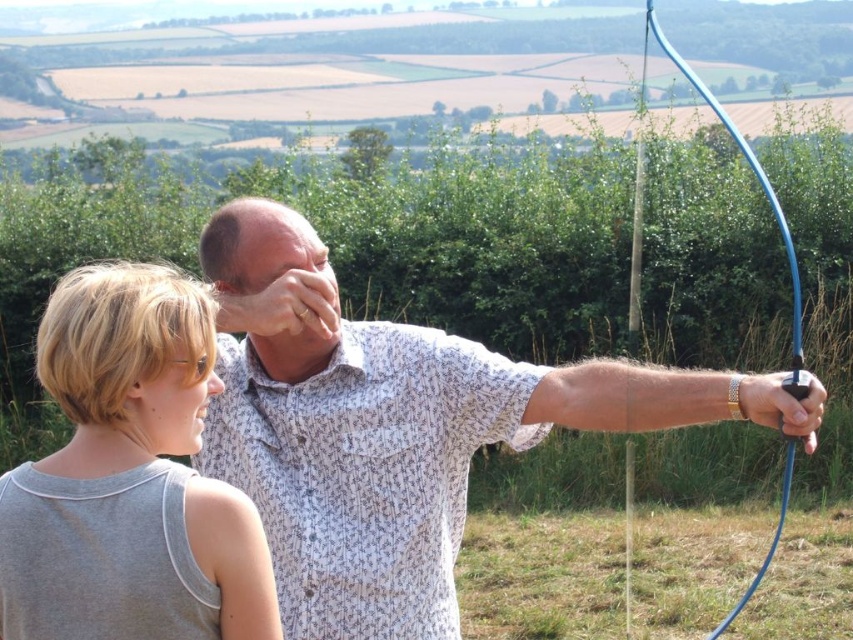
Question: In this image, where is white printed shirt at center located relative to gray fabric shirt at upper left?

Choices:
 (A) below
 (B) above

Answer: (A)

Question: Considering the real-world distances, which object is farthest from the blue rubber bow at right?

Choices:
 (A) gray fabric shirt at upper left
 (B) white printed shirt at center

Answer: (A)

Question: Where is white printed shirt at center located in relation to blue rubber bow at right in the image?

Choices:
 (A) above
 (B) below

Answer: (B)

Question: Which point appears closest to the camera in this image?

Choices:
 (A) (659, 35)
 (B) (135, 577)

Answer: (B)

Question: Is gray fabric shirt at upper left wider than blue rubber bow at right?

Choices:
 (A) no
 (B) yes

Answer: (A)

Question: Which is nearer to the gray fabric shirt at upper left?

Choices:
 (A) blue rubber bow at right
 (B) white printed shirt at center

Answer: (B)